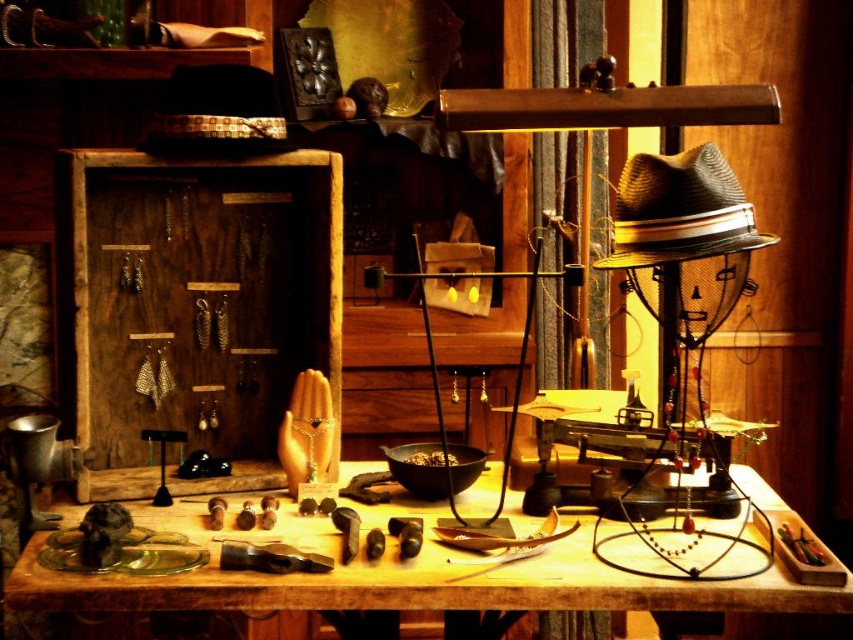
You are a shop assistant arranging items on the table. You need to place a new decorative item that is 12 inches wide. The wooden jewelry display at upper left and the woven straw cowboy hat at upper right are already on the table. Which existing item can you use to determine if the new item will fit on the table without overlapping?

The wooden jewelry display at upper left has a larger width than the woven straw cowboy hat at upper right. If the new item is 12 inches wide, you can compare its width to the wooden jewelry display at upper left. If the new item is smaller than or equal to the display, it should fit without overlapping.

You are standing in front of a vintage display table and notice two points marked on it. The first point is at coordinates point (260, 593) and the second is at point (611, 266). Which of these two points is closer to you?

Point (260, 593) is closer to the viewer than point (611, 266).